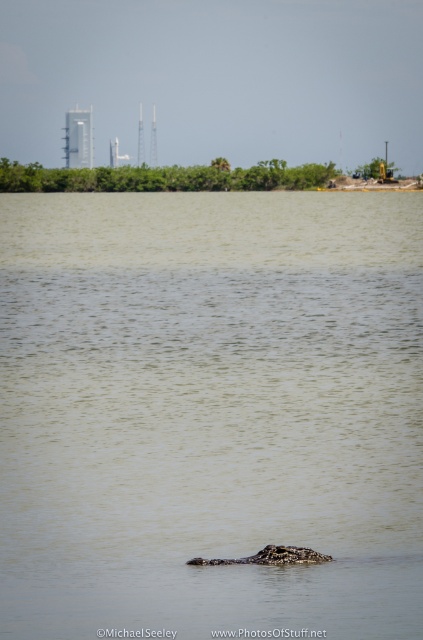
Which of these two, brown textured water at center or dark brown textured crocodile at center, stands shorter?

dark brown textured crocodile at center is shorter.

Is brown textured water at center to the left of dark brown textured crocodile at center from the viewer's perspective?

Indeed, brown textured water at center is positioned on the left side of dark brown textured crocodile at center.

Between point (33, 330) and point (282, 552), which one is positioned in front?

Point (282, 552)

You are a GUI agent. You are given a task and a screenshot of the screen. Output one action in this format:
    pyautogui.click(x=<x>, y=<y>)
    Task: Click on the brown textured water at center
    Image resolution: width=423 pixels, height=640 pixels.
    Given the screenshot: What is the action you would take?
    pyautogui.click(x=209, y=410)